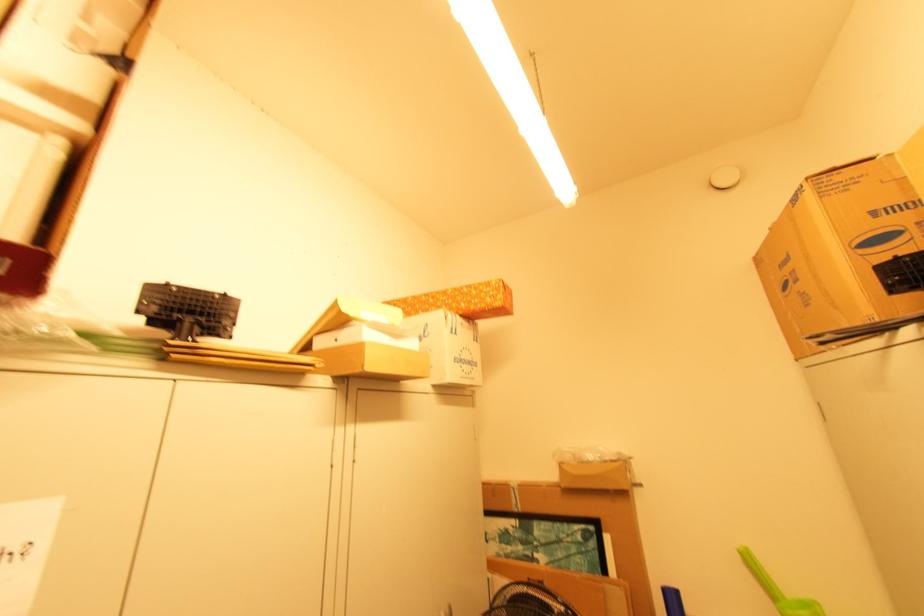
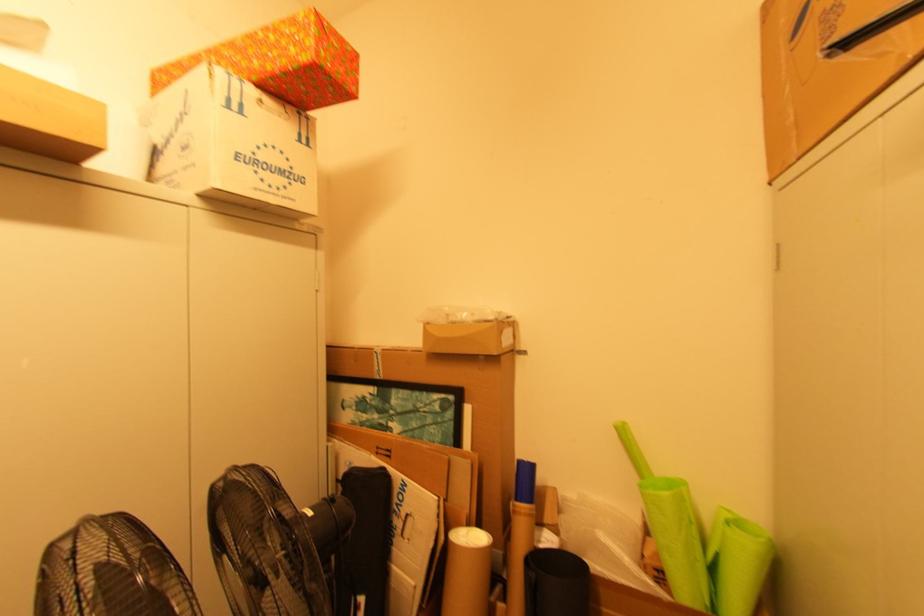
Question: The images are taken continuously from a first-person perspective. In which direction is your viewpoint rotating?

Choices:
 (A) Left
 (B) Right
 (C) Up
 (D) Down

Answer: (D)